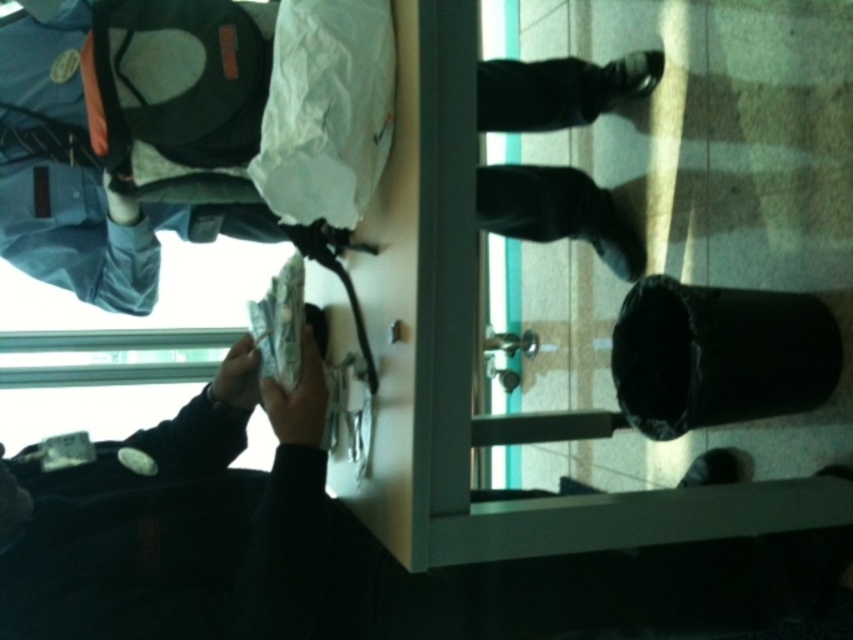
Based on the photo, which is more to the left, white paper money at lower left or black leather shoes at center?

Positioned to the left is white paper money at lower left.

Can you confirm if white paper money at lower left is shorter than black leather shoes at center?

Yes.

What are the coordinates of `white paper money at lower left` in the screenshot? It's located at (180, 525).